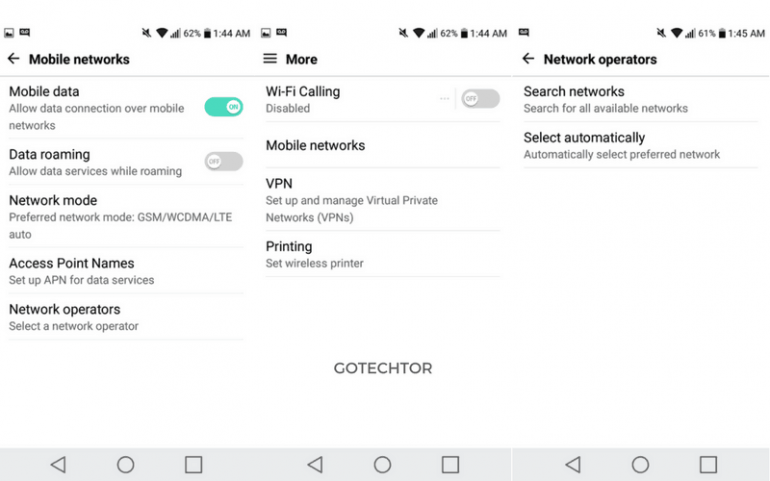
In order to click on space to right of toggle switch in this screenshot , I will do `click(246, 104)`, `click(246, 162)`, `click(500, 97)`.